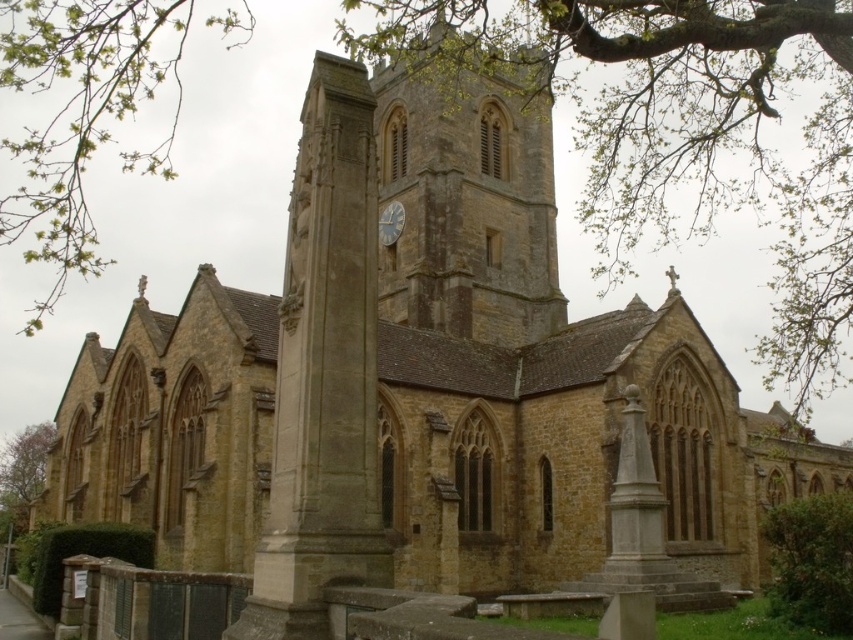
Find the location of a particular element. green leafy branches at upper center is located at coordinates (680, 131).

Is green leafy bush at lower right below green leafy tree at lower left?

No.

Between green leafy bush at lower right and green leafy tree at lower left, which one appears on the right side from the viewer's perspective?

green leafy bush at lower right is more to the right.

Find the location of `green leafy bush at lower right`. green leafy bush at lower right is located at coordinates (811, 561).

The width and height of the screenshot is (853, 640). What do you see at coordinates (80, 115) in the screenshot?
I see `green leafy branches at upper left` at bounding box center [80, 115].

Does green leafy branches at upper left have a smaller size compared to white painted wood clock at center?

No, green leafy branches at upper left is not smaller than white painted wood clock at center.

Does point (18, 38) lie in front of point (398, 211)?

Yes, point (18, 38) is closer to viewer.

At what (x,y) coordinates should I click in order to perform the action: click on green leafy branches at upper left. Please return your answer as a coordinate pair (x, y). Image resolution: width=853 pixels, height=640 pixels. Looking at the image, I should click on (80, 115).